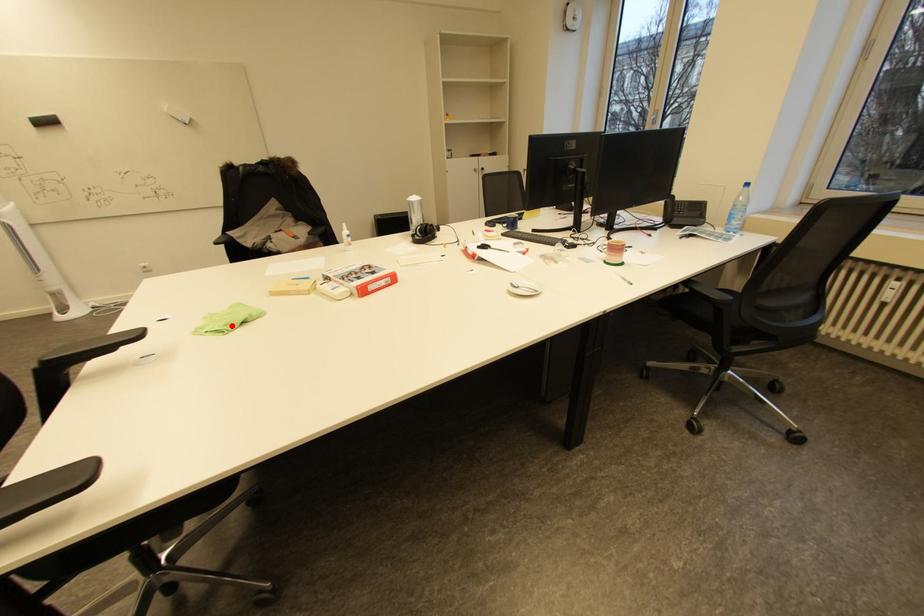
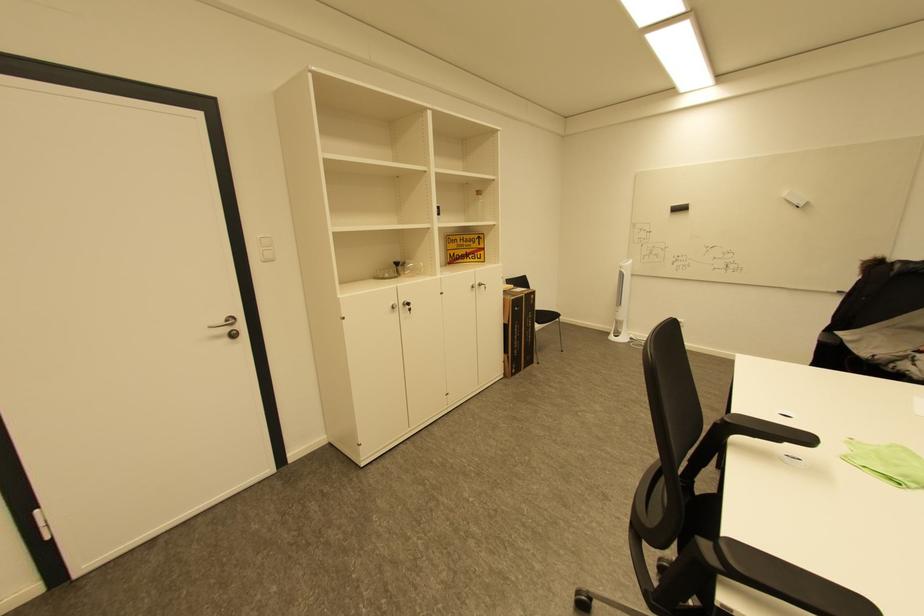
The point at the highlighted location is marked in the first image. Where is the corresponding point in the second image?

(910, 477)